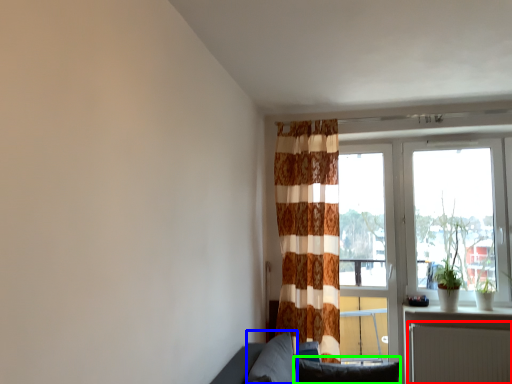
Question: Which is nearer to the radiator (highlighted by a red box)? pillow (highlighted by a blue box) or pillow (highlighted by a green box).

Choices:
 (A) pillow
 (B) pillow

Answer: (B)